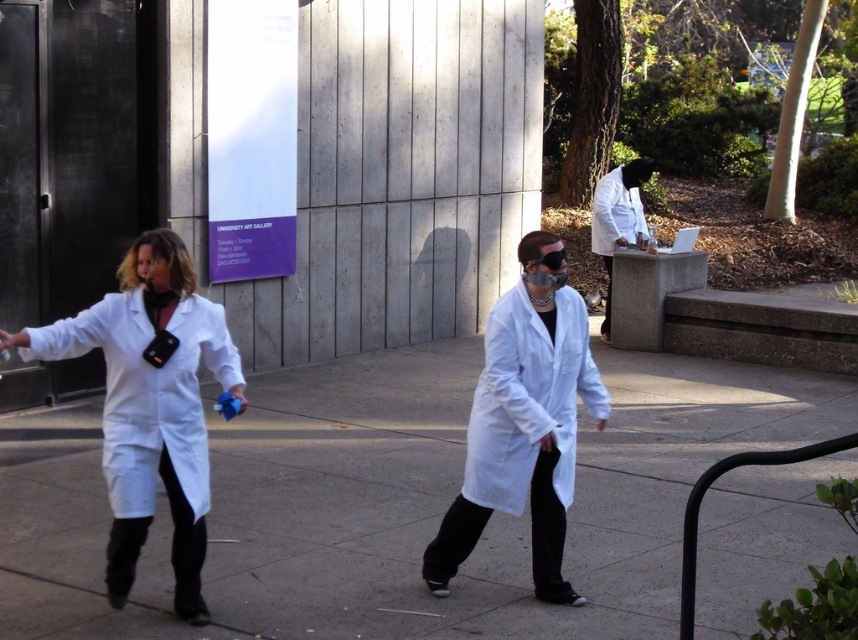
Question: Can you confirm if smooth concrete pavement at center is wider than matte white lab coat at center?

Choices:
 (A) yes
 (B) no

Answer: (A)

Question: Which object appears farthest from the camera in this image?

Choices:
 (A) matte white lab coat at center
 (B) smooth concrete pavement at center
 (C) white matte lab coat at upper center
 (D) white matte lab coat at left

Answer: (C)

Question: Which of the following is the farthest from the observer?

Choices:
 (A) (625, 179)
 (B) (559, 336)
 (C) (674, 515)

Answer: (A)

Question: Can you confirm if white lab coat at right is thinner than white matte lab coat at upper center?

Choices:
 (A) no
 (B) yes

Answer: (A)

Question: Which of the following is the farthest from the observer?

Choices:
 (A) (619, 224)
 (B) (621, 208)
 (C) (608, 410)

Answer: (A)

Question: Can you confirm if matte white lab coat at center is smaller than white lab coat at right?

Choices:
 (A) yes
 (B) no

Answer: (B)